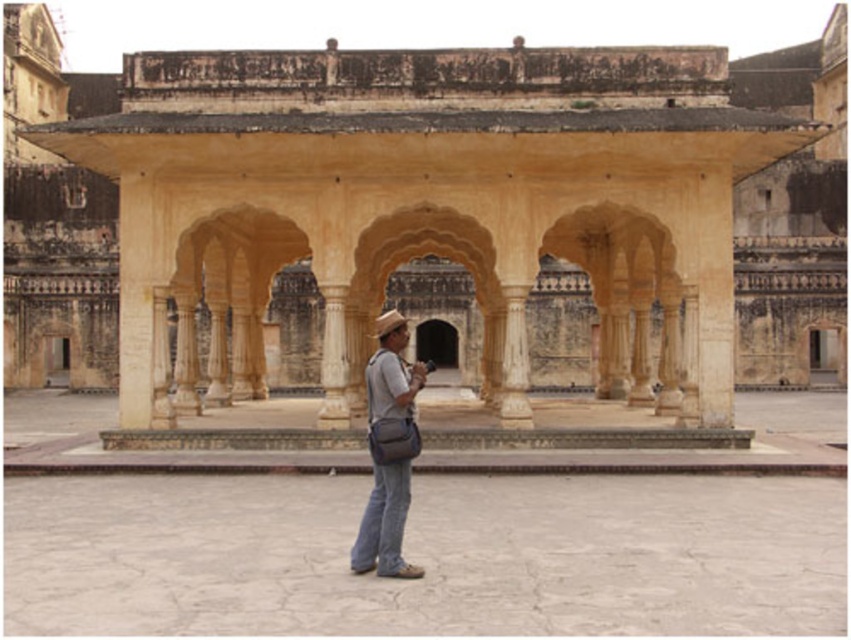
Question: In this image, where is denim jeans at center located relative to denim at center?

Choices:
 (A) below
 (B) above

Answer: (B)

Question: Is beige stone palace at center positioned behind denim at center?

Choices:
 (A) no
 (B) yes

Answer: (B)

Question: Which point is closer to the camera taking this photo?

Choices:
 (A) (401, 573)
 (B) (397, 417)
 (C) (103, 148)

Answer: (A)

Question: Which is farther from the beige stone palace at center?

Choices:
 (A) denim at center
 (B) denim jeans at center

Answer: (A)

Question: Can you confirm if denim jeans at center is positioned to the right of denim at center?

Choices:
 (A) yes
 (B) no

Answer: (B)

Question: Which of the following is the farthest from the observer?

Choices:
 (A) denim jeans at center
 (B) denim at center

Answer: (B)